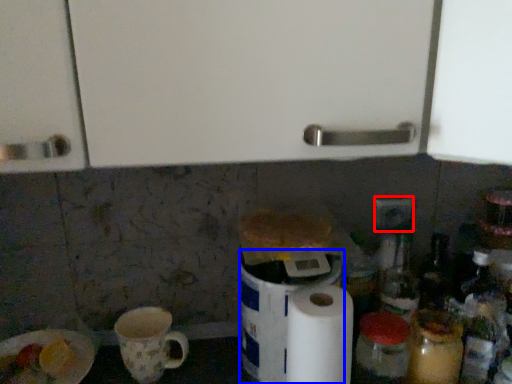
Question: Which object is closer to the camera taking this photo, electric outlet (highlighted by a red box) or appliance (highlighted by a blue box)?

Choices:
 (A) electric outlet
 (B) appliance

Answer: (B)